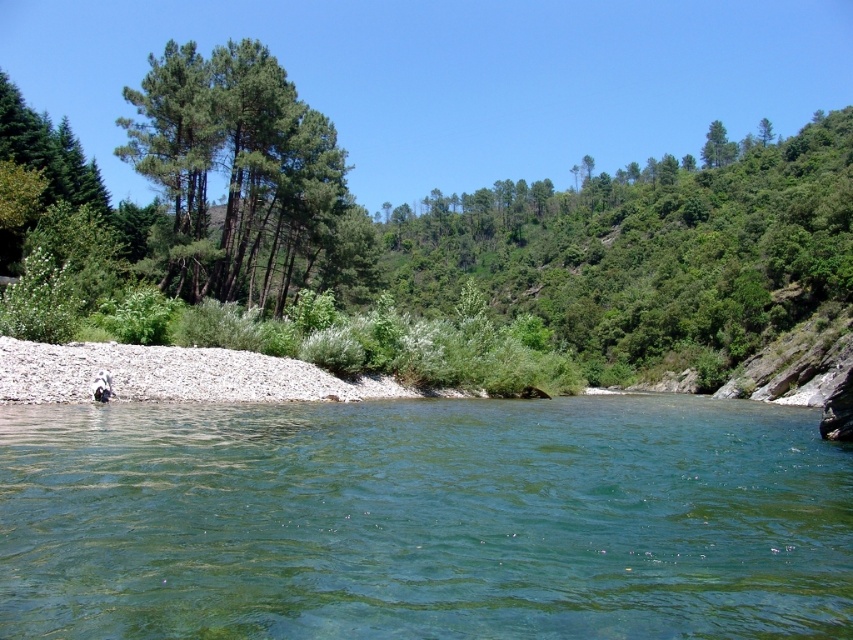
From the picture: Between clear water at center and green matte trees at left, which one is positioned higher?

green matte trees at left is higher up.

Between point (76, 577) and point (209, 244), which one is positioned behind?

The point (209, 244) is behind.

The image size is (853, 640). What are the coordinates of `clear water at center` in the screenshot? It's located at (424, 518).